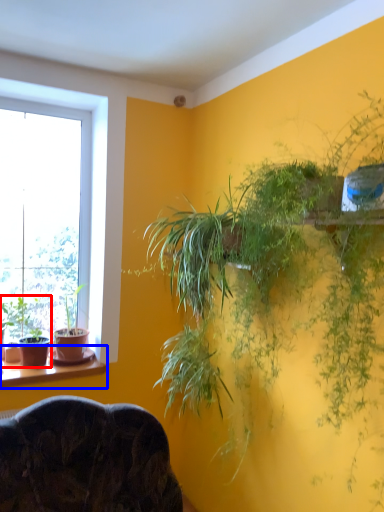
Question: Which object appears farthest to the camera in this image, houseplant (highlighted by a red box) or window sill (highlighted by a blue box)?

Choices:
 (A) houseplant
 (B) window sill

Answer: (A)